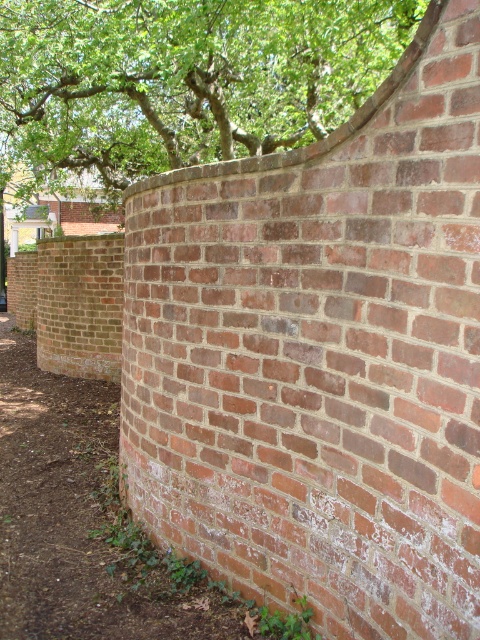
You are a gardener looking at the image. You need to determine the relative positions of the green leafy tree at upper center and the brick wall at center. Which object is positioned higher in the scene?

The green leafy tree at upper center is positioned higher than the brick wall at center.

You are planning to install a decorative light strip along the top edge of the brick wall at center. Considering the green leafy tree at upper center, will its width interfere with the installation? Please explain.

The green leafy tree at upper center is wider than the brick wall at center. This means the tree may extend beyond the wall, potentially obstructing the installation of the light strip along the top edge. Ensure there is enough clearance before proceeding.